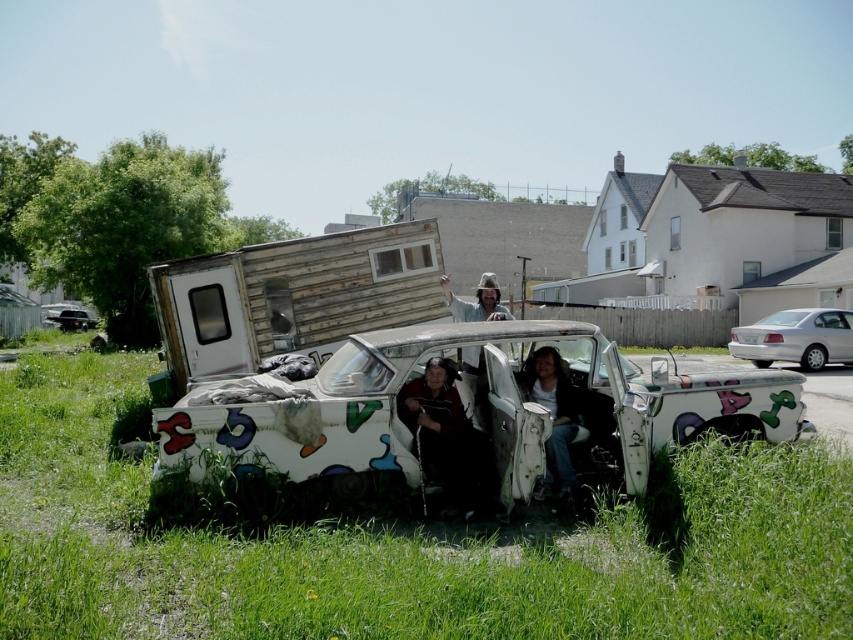
Is white graffiti-covered truck at center to the right of dark brown leather jacket at center from the viewer's perspective?

Indeed, white graffiti-covered truck at center is positioned on the right side of dark brown leather jacket at center.

Is point (445, 374) in front of point (444, 392)?

Yes, it is.

At what (x,y) coordinates should I click in order to perform the action: click on white graffiti-covered truck at center. Please return your answer as a coordinate pair (x, y). This screenshot has height=640, width=853. Looking at the image, I should click on (473, 413).

Is white graffiti-covered truck at center above wooden hat at center?

Actually, white graffiti-covered truck at center is below wooden hat at center.

Does white graffiti-covered truck at center come behind wooden hat at center?

No.

Locate an element on the screen. This screenshot has height=640, width=853. white graffiti-covered truck at center is located at coordinates (473, 413).

Is green grass at lower center smaller than wooden camper at center?

Actually, green grass at lower center might be larger than wooden camper at center.

Is point (53, 387) farther from camera compared to point (201, 307)?

That is True.

Describe the element at coordinates (393, 541) in the screenshot. The image size is (853, 640). I see `green grass at lower center` at that location.

Find the location of a particular element. The height and width of the screenshot is (640, 853). green grass at lower center is located at coordinates (393, 541).